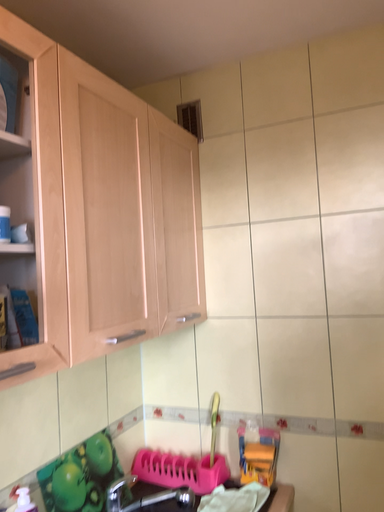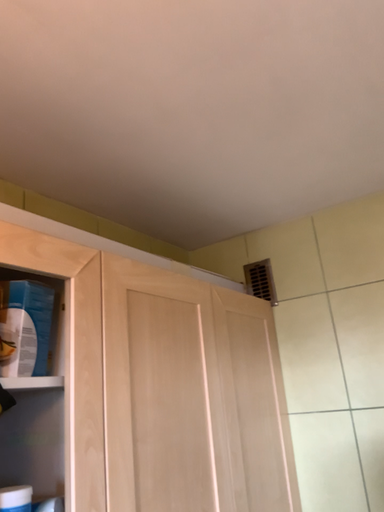
Question: How did the camera likely rotate when shooting the video?

Choices:
 (A) rotated right
 (B) rotated left

Answer: (B)